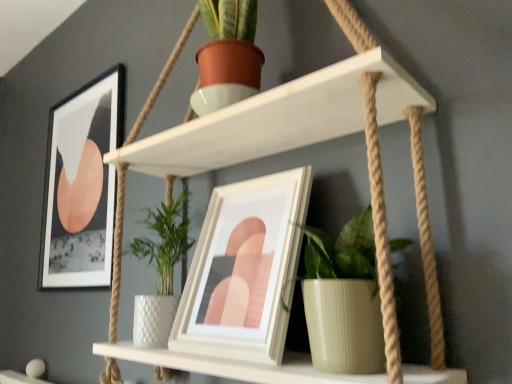
Question: From the image's perspective, is white matte shelf at upper center under matte black picture frame at upper left, which ranks as the 1th picture frame in left-to-right order?

Choices:
 (A) yes
 (B) no

Answer: (B)

Question: Is white matte shelf at upper center shorter than matte black picture frame at upper left, marked as the 2th picture frame in a right-to-left arrangement?

Choices:
 (A) no
 (B) yes

Answer: (A)

Question: Does white matte shelf at upper center have a larger size compared to matte black picture frame at upper left, marked as the 2th picture frame in a right-to-left arrangement?

Choices:
 (A) yes
 (B) no

Answer: (A)

Question: Is white matte shelf at upper center facing away from matte black picture frame at upper left, which ranks as the 1th picture frame in left-to-right order?

Choices:
 (A) yes
 (B) no

Answer: (B)

Question: Does white matte shelf at upper center come in front of matte black picture frame at upper left, marked as the 2th picture frame in a right-to-left arrangement?

Choices:
 (A) no
 (B) yes

Answer: (B)

Question: Is white matte shelf at upper center in front of or behind matte black picture frame at upper left, marked as the 2th picture frame in a right-to-left arrangement, in the image?

Choices:
 (A) behind
 (B) front

Answer: (B)

Question: From the image's perspective, is white matte shelf at upper center above or below matte black picture frame at upper left, which appears as the 1th picture frame when viewed from the back?

Choices:
 (A) below
 (B) above

Answer: (B)

Question: In terms of height, does white matte shelf at upper center look taller or shorter compared to matte black picture frame at upper left, which ranks as the 1th picture frame in left-to-right order?

Choices:
 (A) short
 (B) tall

Answer: (B)

Question: Do you think white matte shelf at upper center is within matte black picture frame at upper left, which appears as the 1th picture frame when viewed from the back, or outside of it?

Choices:
 (A) outside
 (B) inside

Answer: (A)

Question: Looking at the image, does green ribbed pot at center seem bigger or smaller compared to white matte shelf at upper center?

Choices:
 (A) big
 (B) small

Answer: (B)

Question: Is green ribbed pot at center situated inside white matte shelf at upper center or outside?

Choices:
 (A) outside
 (B) inside

Answer: (B)

Question: From their relative heights in the image, would you say green ribbed pot at center is taller or shorter than white matte shelf at upper center?

Choices:
 (A) tall
 (B) short

Answer: (B)

Question: Is green ribbed pot at center in front of or behind white matte shelf at upper center in the image?

Choices:
 (A) behind
 (B) front

Answer: (A)

Question: Considering the positions of green ribbed pot at center and white glossy picture frame at center, which is the first picture frame in right-to-left order, in the image, is green ribbed pot at center taller or shorter than white glossy picture frame at center, which is the first picture frame in right-to-left order,?

Choices:
 (A) short
 (B) tall

Answer: (A)

Question: In terms of width, does green ribbed pot at center look wider or thinner when compared to white glossy picture frame at center, marked as the 1th picture frame in a front-to-back arrangement?

Choices:
 (A) thin
 (B) wide

Answer: (A)